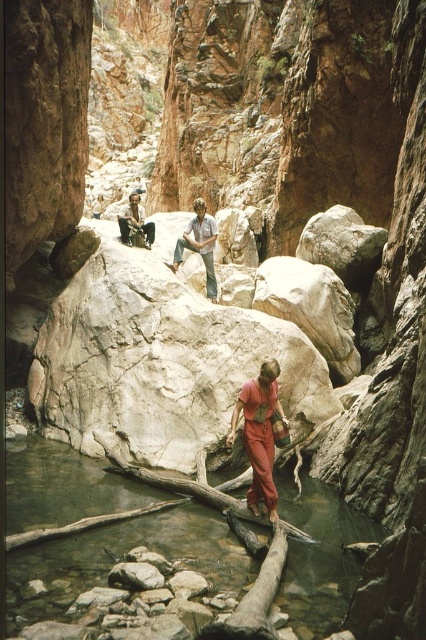
Does clear water at creek center have a greater width compared to matte orange jumpsuit at center?

Yes.

Between clear water at creek center and matte orange jumpsuit at center, which one has more height?

With more height is matte orange jumpsuit at center.

Is point (321, 492) closer to viewer compared to point (268, 490)?

No, (321, 492) is behind (268, 490).

Locate an element on the screen. The image size is (426, 640). clear water at creek center is located at coordinates (124, 586).

Is point (270, 492) positioned in front of point (129, 209)?

That is True.

Who is more distant from viewer, (268, 509) or (144, 225)?

The point (144, 225) is behind.

Between point (256, 488) and point (124, 218), which one is positioned behind?

The point (124, 218) is behind.

This screenshot has height=640, width=426. What are the coordinates of `matte orange jumpsuit at center` in the screenshot? It's located at (259, 433).

From the picture: Is clear water at creek center to the right of light blue denim jeans at center from the viewer's perspective?

Yes, clear water at creek center is to the right of light blue denim jeans at center.

Can you confirm if clear water at creek center is taller than light blue denim jeans at center?

In fact, clear water at creek center may be shorter than light blue denim jeans at center.

The height and width of the screenshot is (640, 426). What are the coordinates of `clear water at creek center` in the screenshot? It's located at (124, 586).